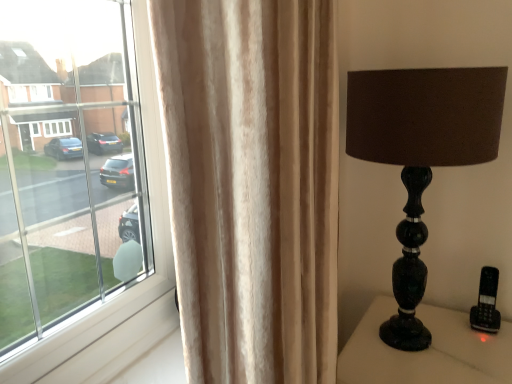
The image size is (512, 384). I want to click on empty space that is ontop of black marble lamp at right, so click(414, 347).